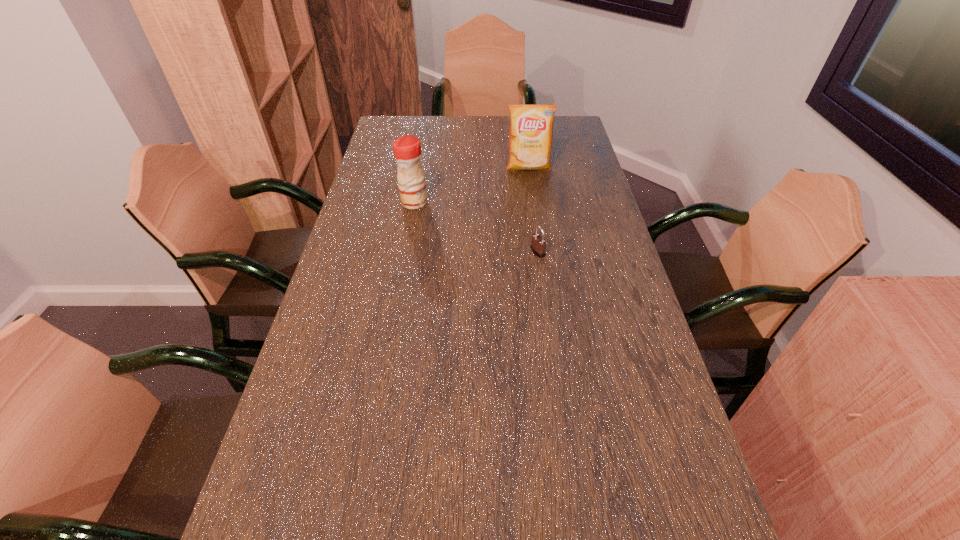
Find the location of a particular element. The height and width of the screenshot is (540, 960). the second farthest object is located at coordinates (407, 149).

At what (x,y) coordinates should I click in order to perform the action: click on the leftmost object. Please return your answer as a coordinate pair (x, y). The height and width of the screenshot is (540, 960). Looking at the image, I should click on (407, 149).

Identify the location of the farthest object. The height and width of the screenshot is (540, 960). (531, 126).

Where is `the shortest object`? the shortest object is located at coordinates (538, 244).

At what (x,y) coordinates should I click in order to perform the action: click on padlock. Please return your answer as a coordinate pair (x, y). Looking at the image, I should click on (538, 244).

This screenshot has width=960, height=540. Identify the location of vacant space located on the back of the second nearest object. (419, 177).

This screenshot has height=540, width=960. Find the location of `vacant space located 0.230m on the front-facing side of the crisp (potato chip)`. vacant space located 0.230m on the front-facing side of the crisp (potato chip) is located at coordinates (535, 213).

Identify the location of free spot located 0.240m on the left of the nearest object. (449, 252).

Locate an element on the screen. The width and height of the screenshot is (960, 540). object positioned at the left edge is located at coordinates (407, 149).

This screenshot has height=540, width=960. What are the coordinates of `object at the right edge` in the screenshot? It's located at (531, 126).